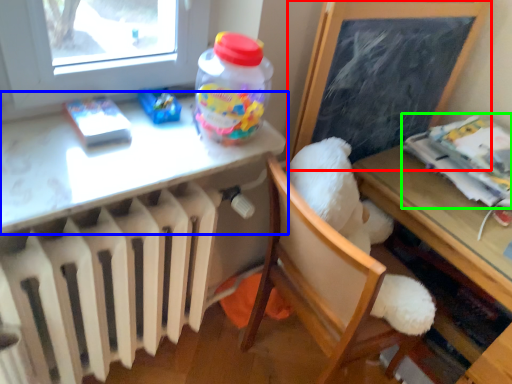
Question: Considering the real-world distances, which object is closest to bulletin board (highlighted by a red box)? table (highlighted by a blue box) or magazine (highlighted by a green box).

Choices:
 (A) table
 (B) magazine

Answer: (B)